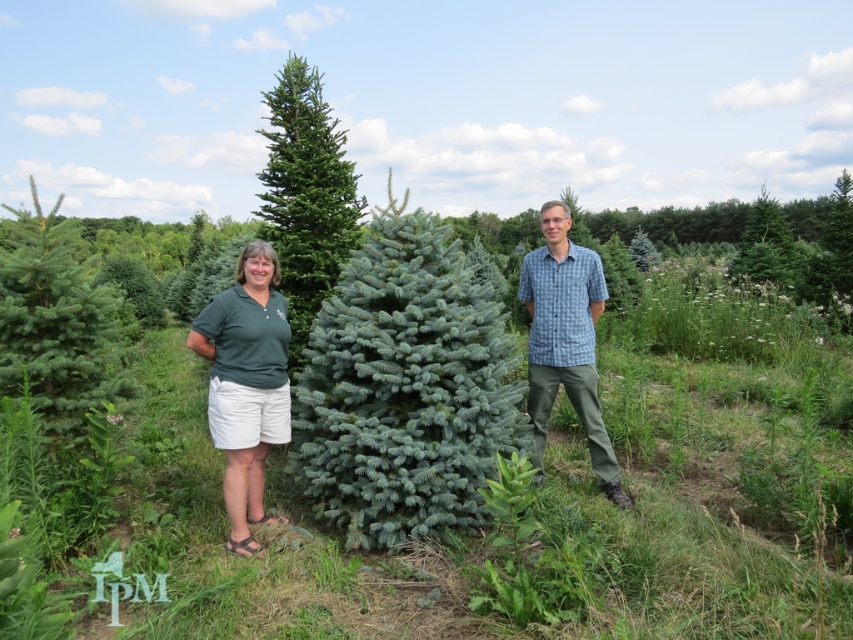
You are a photographer standing at the camera position. You want to take a photo of both the point at (291, 241) and the point at (248, 264). Which point will appear closer to the front of the photo?

The point at (248, 264) will appear closer to the front of the photo because it is closer to the camera than the point at (291, 241).